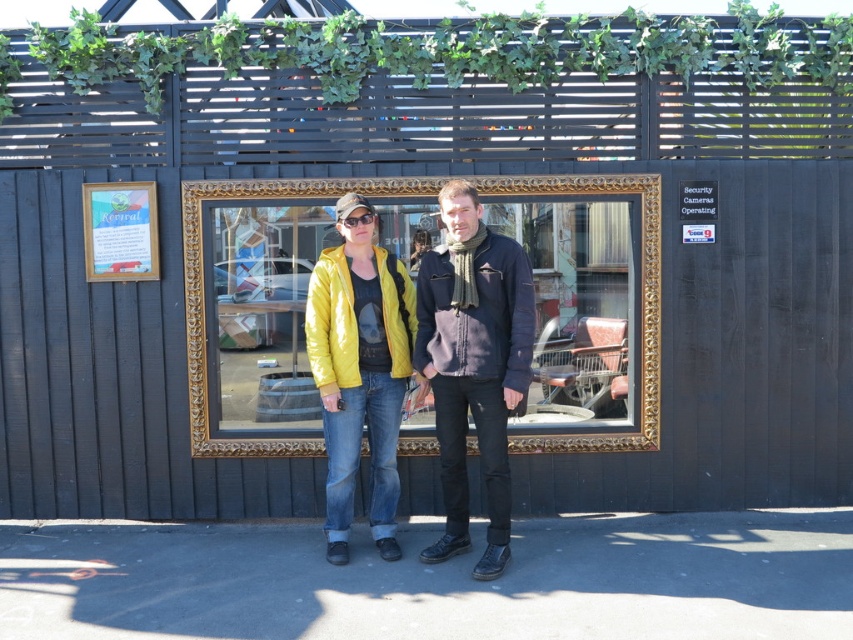
Is gold/gilded picture frame at center bigger than wooden sign at upper left?

Yes.

Can you confirm if gold/gilded picture frame at center is positioned to the right of wooden sign at upper left?

Yes, gold/gilded picture frame at center is to the right of wooden sign at upper left.

Where is `gold/gilded picture frame at center`? The image size is (853, 640). gold/gilded picture frame at center is located at coordinates (270, 300).

At what (x,y) coordinates should I click in order to perform the action: click on gold/gilded picture frame at center. Please return your answer as a coordinate pair (x, y). Looking at the image, I should click on (270, 300).

Which of these two, gold/gilded picture frame at center or glossy yellow jacket at center, stands taller?

With more height is gold/gilded picture frame at center.

Image resolution: width=853 pixels, height=640 pixels. Describe the element at coordinates (270, 300) in the screenshot. I see `gold/gilded picture frame at center` at that location.

The width and height of the screenshot is (853, 640). Identify the location of gold/gilded picture frame at center. (270, 300).

Does dark blue fleece jacket at center lie behind wooden sign at upper left?

No.

Does dark blue fleece jacket at center appear over wooden sign at upper left?

Incorrect, dark blue fleece jacket at center is not positioned above wooden sign at upper left.

Who is more distant from viewer, (x=476, y=292) or (x=154, y=253)?

Point (x=154, y=253)

This screenshot has height=640, width=853. Identify the location of dark blue fleece jacket at center. click(477, 316).